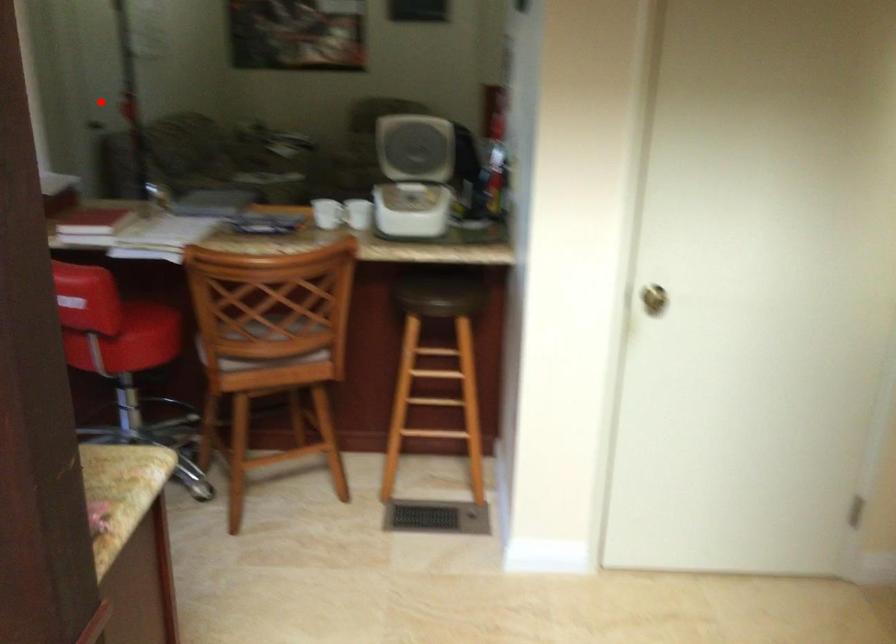
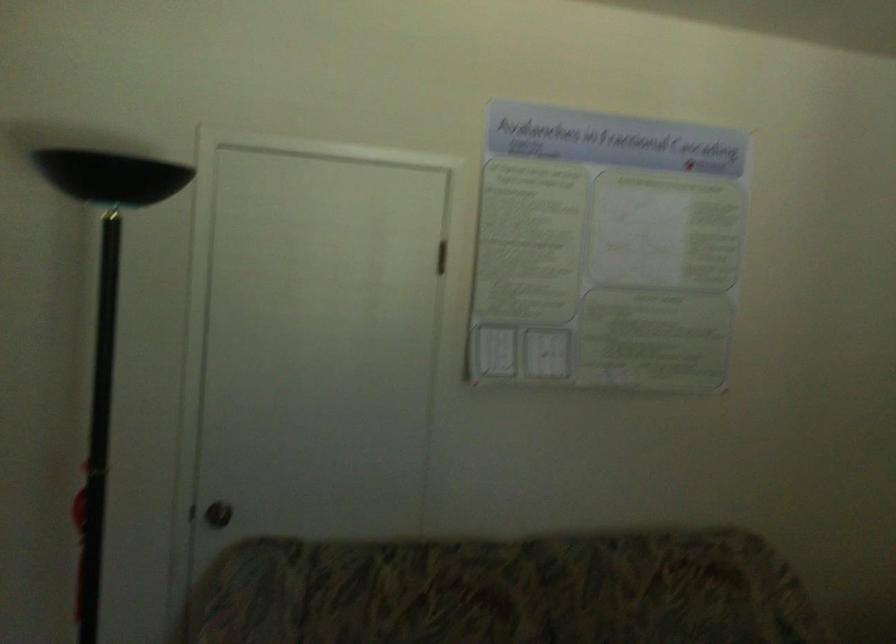
Find the pixel in the second image that matches the highlighted location in the first image.

(218, 514)